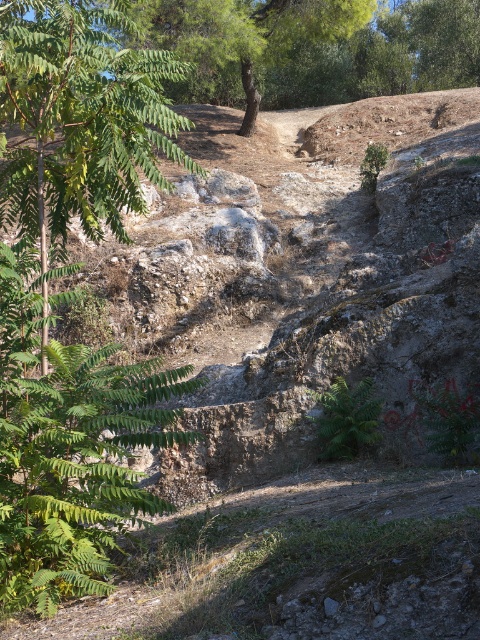
You are standing in the natural outdoor scene described. You need to locate the green leafy fern at left. According to the coordinates provided, where would you look relative to the center of the image?

The green leafy fern at left is located at coordinates approximately 0.703 on the x axis and 0.144 on the y axis, which places it to the right and slightly below the center of the image.

You are a botanist studying fern growth patterns. You observe two green leafy ferns in the scene. Based on their positions, which fern, the green leafy fern at left or the green leafy fern at center, has a larger spread in terms of width?

The green leafy fern at left might be wider than green leafy fern at center, so it likely has a larger spread in width.

In the scene shown: You are a hiker trying to navigate through the rocky terrain. You notice the green leafy fern at left and the green leafy tree at upper center. Which of these two plants has a wider spread in terms of width?

The green leafy tree at upper center has a wider spread in terms of width compared to the green leafy fern at left, as the fern is narrower.